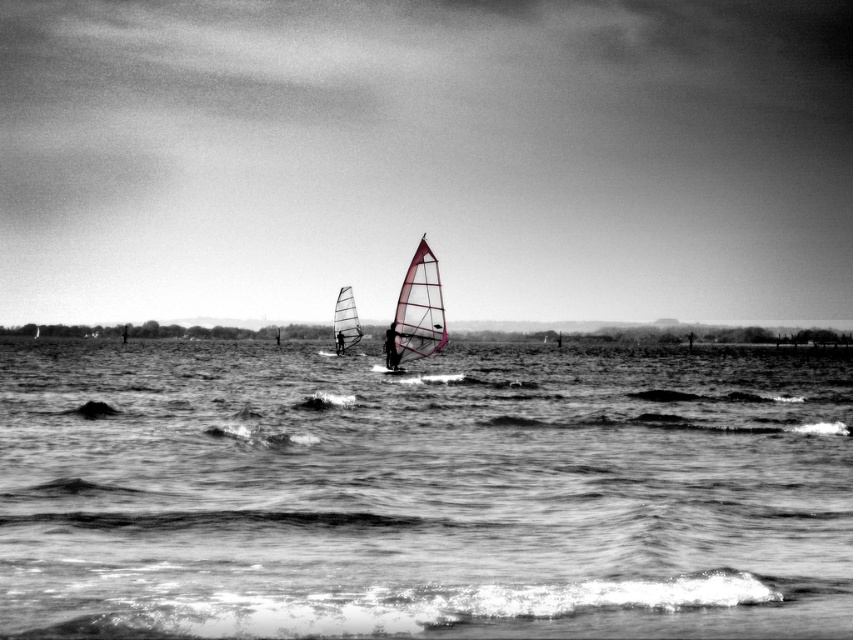
Question: Which object appears farthest from the camera in this image?

Choices:
 (A) matte pink sail at center
 (B) smooth water at center

Answer: (A)

Question: Does pink translucent sail at center appear under matte pink sail at center?

Choices:
 (A) yes
 (B) no

Answer: (B)

Question: Which point appears farthest from the camera in this image?

Choices:
 (A) (444, 339)
 (B) (392, 324)
 (C) (340, 337)

Answer: (C)

Question: Which point is farther to the camera?

Choices:
 (A) (421, 330)
 (B) (387, 326)
 (C) (637, 627)
 (D) (350, 288)

Answer: (D)

Question: Is transparent plastic sail at center smaller than matte pink sail at center?

Choices:
 (A) yes
 (B) no

Answer: (B)

Question: Is transparent plastic sail at center wider than white sail at center?

Choices:
 (A) yes
 (B) no

Answer: (A)